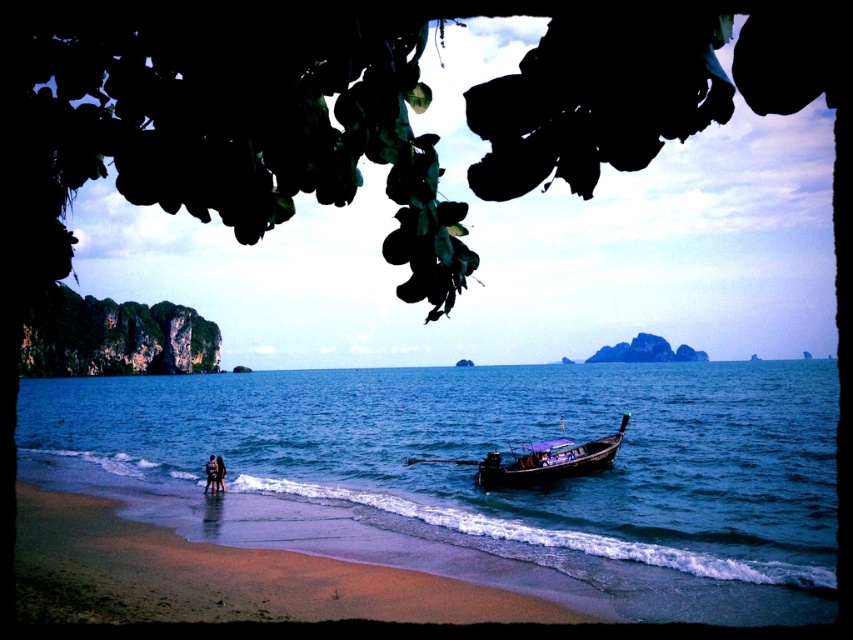
You are standing on the sandy beach at lower left and want to reach the wooden canoe at center. Which direction should you walk to get there?

You should walk to the right because the sandy beach at lower left is to the left of the wooden canoe at center, so moving right will take you towards the canoe.

You are a photographer trying to capture the longtail boat with purple canopy anchored close to the shore in the middle ground of the beach scene. There is a green leafy rock at upper left located at point (115, 337). To ensure the boat is the main focus, which object at what coordinate should you avoid blocking the view of the boat?

You should avoid blocking the view of the longtail boat with purple canopy anchored close to the shore by ensuring the green leafy rock at upper left located at point (115, 337) does not obstruct the boat in the middle ground.

You are standing at the center of the image and want to walk to the sandy beach at lower left. According to the coordinates provided in the Objects Description, in which direction should you move relative to your current position?

The sandy beach at lower left is located at coordinates point (222, 577). Since the x coordinate is 0.903, which is closer to the right edge of the image, and the y coordinate is 0.261, which is closer to the bottom, you should move diagonally towards the lower right direction to reach it.